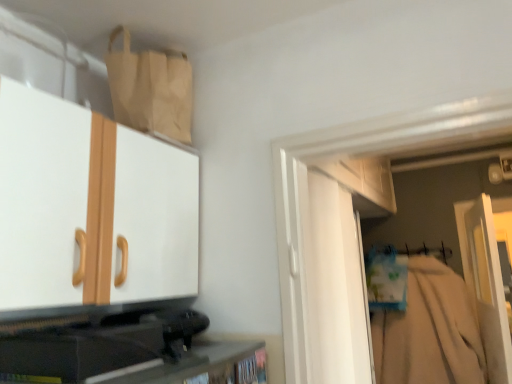
What are the coordinates of `free location above black plastic speaker at lower left, acting as the first cabinetry starting from the bottom (from a real-world perspective)` in the screenshot? It's located at (68, 330).